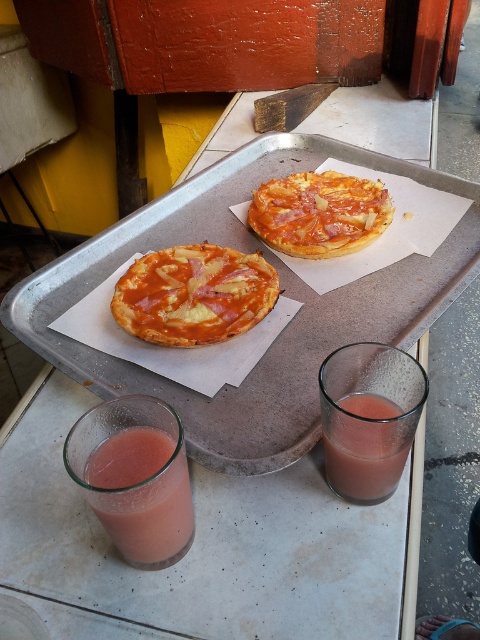
Question: Which point is closer to the camera?

Choices:
 (A) (367, 435)
 (B) (375, 276)
 (C) (168, 294)

Answer: (A)

Question: Does translucent glass at lower left have a smaller size compared to golden-brown crispy pizza at center?

Choices:
 (A) yes
 (B) no

Answer: (A)

Question: Does transparent glass at center appear on the right side of translucent glass at lower center?

Choices:
 (A) no
 (B) yes

Answer: (A)

Question: Estimate the real-world distances between objects in this image. Which object is closer to the translucent glass at lower left?

Choices:
 (A) matte orange pizza at left
 (B) transparent glass at center

Answer: (B)

Question: Is silver metallic tray at center to the right of translucent glass at lower left from the viewer's perspective?

Choices:
 (A) yes
 (B) no

Answer: (A)

Question: Estimate the real-world distances between objects in this image. Which object is farther from the transparent glass at center?

Choices:
 (A) translucent glass at lower left
 (B) matte orange pizza at left
 (C) silver metallic tray at center
 (D) translucent glass at lower center

Answer: (B)